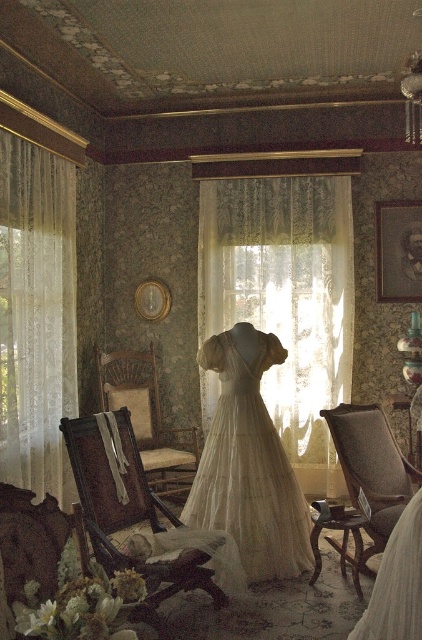
Is white lace curtain at center wider than wooden armchair at center?

Yes.

Does point (302, 458) come farther from viewer compared to point (78, 456)?

That is True.

Measure the distance between point (248, 312) and camera.

Point (248, 312) and camera are 5.55 meters apart from each other.

This screenshot has width=422, height=640. Find the location of `white lace curtain at center`. white lace curtain at center is located at coordinates (286, 300).

Is white lace curtain at center below brown woven armchair at center?

Incorrect, white lace curtain at center is not positioned below brown woven armchair at center.

Which is below, white lace curtain at center or brown woven armchair at center?

brown woven armchair at center

Between point (205, 392) and point (175, 493), which one is positioned in front?

Point (175, 493)

Locate an element on the screen. The width and height of the screenshot is (422, 640). white lace curtain at center is located at coordinates (286, 300).

Based on the photo, does white lace curtain at left have a smaller size compared to velvet upholstered armchair at center?

No, white lace curtain at left is not smaller than velvet upholstered armchair at center.

Can you confirm if white lace curtain at left is shorter than velvet upholstered armchair at center?

In fact, white lace curtain at left may be taller than velvet upholstered armchair at center.

This screenshot has height=640, width=422. Identify the location of white lace curtain at left. (37, 316).